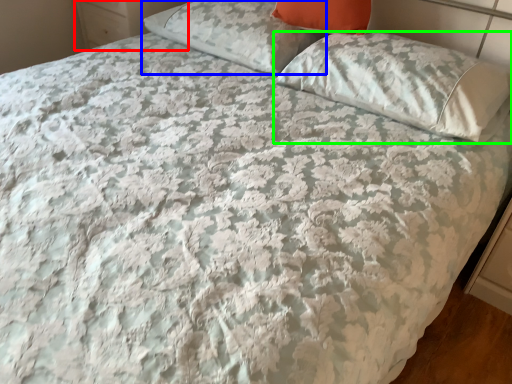
Question: Estimate the real-world distances between objects in this image. Which object is closer to dresser (highlighted by a red box), pillow (highlighted by a blue box) or pillow (highlighted by a green box)?

Choices:
 (A) pillow
 (B) pillow

Answer: (A)